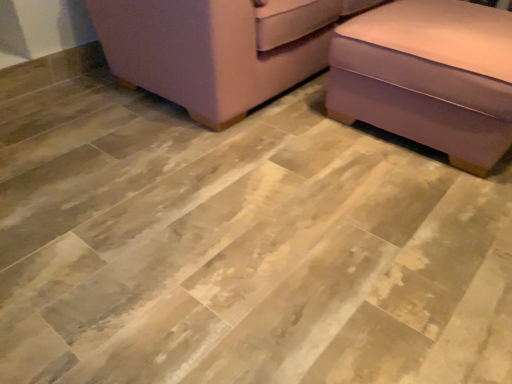
Question: Considering the relative sizes of pink fabric couch at upper right, positioned as the first furniture in left-to-right order, and purple fabric ottoman at lower right, the first furniture positioned from the right, in the image provided, is pink fabric couch at upper right, positioned as the first furniture in left-to-right order, taller than purple fabric ottoman at lower right, the first furniture positioned from the right,?

Choices:
 (A) no
 (B) yes

Answer: (B)

Question: Is pink fabric couch at upper right, which appears as the second furniture when viewed from the right, facing towards purple fabric ottoman at lower right, the first furniture positioned from the right?

Choices:
 (A) yes
 (B) no

Answer: (A)

Question: Is pink fabric couch at upper right, which appears as the second furniture when viewed from the right, further to camera compared to purple fabric ottoman at lower right, arranged as the second furniture when viewed from the left?

Choices:
 (A) no
 (B) yes

Answer: (B)

Question: From the image's perspective, is pink fabric couch at upper right, positioned as the first furniture in left-to-right order, under purple fabric ottoman at lower right, arranged as the second furniture when viewed from the left?

Choices:
 (A) yes
 (B) no

Answer: (B)

Question: From the image's perspective, is pink fabric couch at upper right, positioned as the first furniture in left-to-right order, located above purple fabric ottoman at lower right, the first furniture positioned from the right?

Choices:
 (A) yes
 (B) no

Answer: (A)

Question: Is pink fabric couch at upper right, positioned as the first furniture in left-to-right order, facing away from purple fabric ottoman at lower right, arranged as the second furniture when viewed from the left?

Choices:
 (A) no
 (B) yes

Answer: (A)

Question: Is purple fabric ottoman at lower right, arranged as the second furniture when viewed from the left, not near pink fabric couch at upper right, positioned as the first furniture in left-to-right order?

Choices:
 (A) no
 (B) yes

Answer: (A)

Question: Is the depth of purple fabric ottoman at lower right, the first furniture positioned from the right, greater than that of pink fabric couch at upper right, positioned as the first furniture in left-to-right order?

Choices:
 (A) no
 (B) yes

Answer: (A)

Question: Does purple fabric ottoman at lower right, arranged as the second furniture when viewed from the left, turn towards pink fabric couch at upper right, which appears as the second furniture when viewed from the right?

Choices:
 (A) no
 (B) yes

Answer: (A)

Question: Considering the relative sizes of purple fabric ottoman at lower right, arranged as the second furniture when viewed from the left, and pink fabric couch at upper right, positioned as the first furniture in left-to-right order, in the image provided, is purple fabric ottoman at lower right, arranged as the second furniture when viewed from the left, taller than pink fabric couch at upper right, positioned as the first furniture in left-to-right order,?

Choices:
 (A) no
 (B) yes

Answer: (A)

Question: Considering the relative sizes of purple fabric ottoman at lower right, arranged as the second furniture when viewed from the left, and pink fabric couch at upper right, positioned as the first furniture in left-to-right order, in the image provided, is purple fabric ottoman at lower right, arranged as the second furniture when viewed from the left, smaller than pink fabric couch at upper right, positioned as the first furniture in left-to-right order,?

Choices:
 (A) no
 (B) yes

Answer: (B)

Question: From the image's perspective, is purple fabric ottoman at lower right, the first furniture positioned from the right, located beneath pink fabric couch at upper right, which appears as the second furniture when viewed from the right?

Choices:
 (A) yes
 (B) no

Answer: (A)

Question: Visually, is pink fabric couch at upper right, positioned as the first furniture in left-to-right order, positioned to the left or to the right of purple fabric ottoman at lower right, the first furniture positioned from the right?

Choices:
 (A) right
 (B) left

Answer: (B)